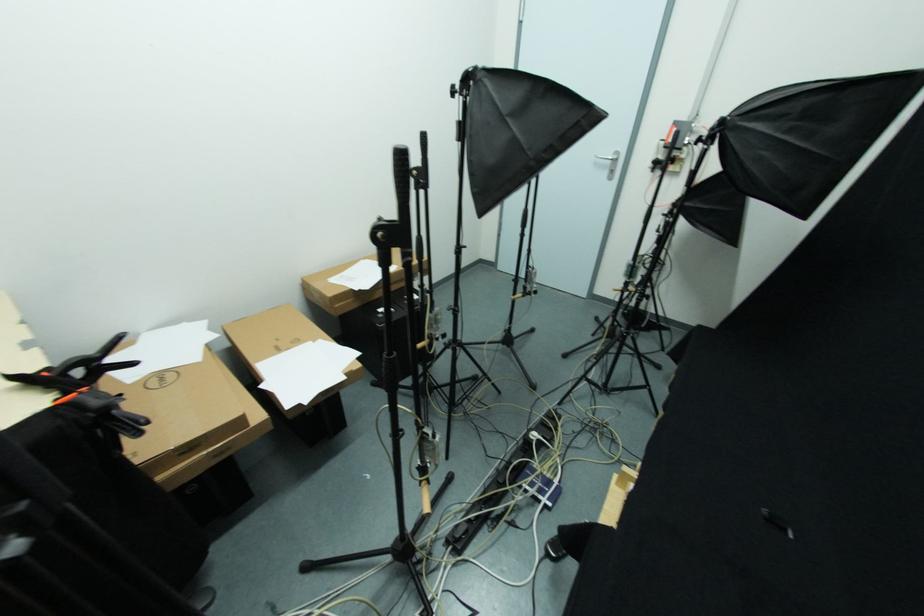
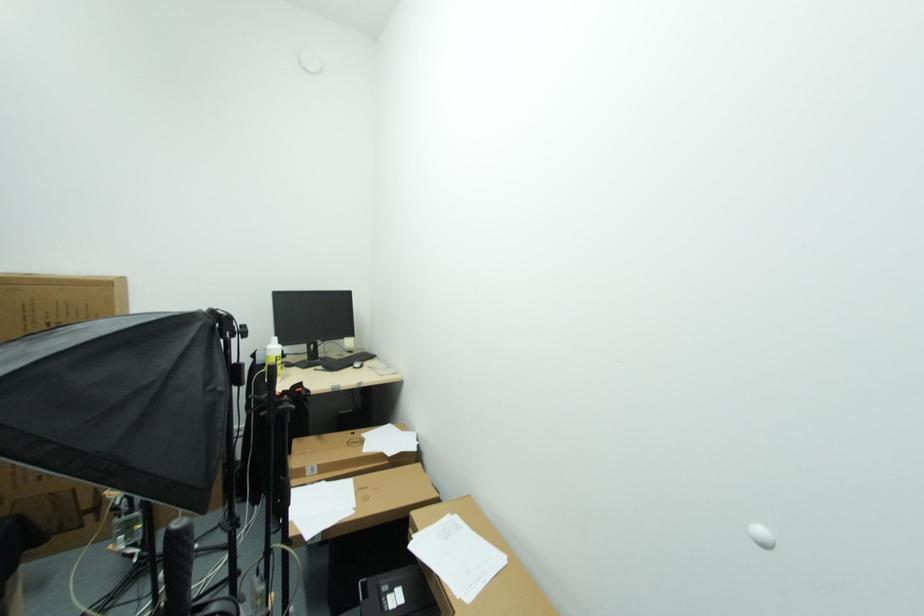
In the second image, find the point that corresponds to pixel 360 292 in the first image.

(414, 541)